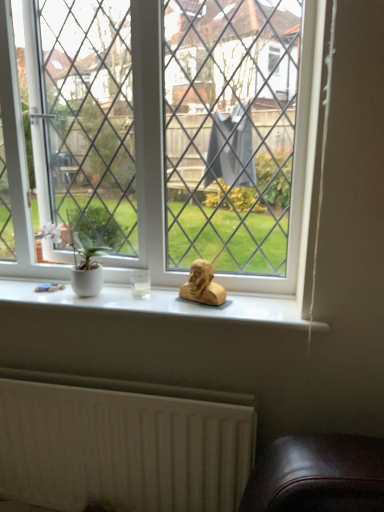
Question: From a real-world perspective, is white textured radiator at lower left located higher than matte gold bust at center?

Choices:
 (A) no
 (B) yes

Answer: (A)

Question: Considering the relative sizes of white textured radiator at lower left and matte gold bust at center in the image provided, is white textured radiator at lower left shorter than matte gold bust at center?

Choices:
 (A) yes
 (B) no

Answer: (B)

Question: Are white textured radiator at lower left and matte gold bust at center located far from each other?

Choices:
 (A) no
 (B) yes

Answer: (A)

Question: From a real-world perspective, is white textured radiator at lower left beneath matte gold bust at center?

Choices:
 (A) no
 (B) yes

Answer: (B)

Question: Is matte gold bust at center at the back of white textured radiator at lower left?

Choices:
 (A) no
 (B) yes

Answer: (A)

Question: Is matte gold bust at center inside white textured radiator at lower left?

Choices:
 (A) no
 (B) yes

Answer: (A)

Question: Considering the relative sizes of clear glass window at center and matte gold bust at center in the image provided, is clear glass window at center smaller than matte gold bust at center?

Choices:
 (A) yes
 (B) no

Answer: (B)

Question: Can you confirm if clear glass window at center is bigger than matte gold bust at center?

Choices:
 (A) yes
 (B) no

Answer: (A)

Question: Is clear glass window at center taller than matte gold bust at center?

Choices:
 (A) yes
 (B) no

Answer: (A)

Question: Does clear glass window at center come in front of matte gold bust at center?

Choices:
 (A) yes
 (B) no

Answer: (A)

Question: Is clear glass window at center shorter than matte gold bust at center?

Choices:
 (A) no
 (B) yes

Answer: (A)

Question: From the image's perspective, is clear glass window at center below matte gold bust at center?

Choices:
 (A) yes
 (B) no

Answer: (B)

Question: Is white textured radiator at lower left far away from clear glass window at center?

Choices:
 (A) no
 (B) yes

Answer: (A)